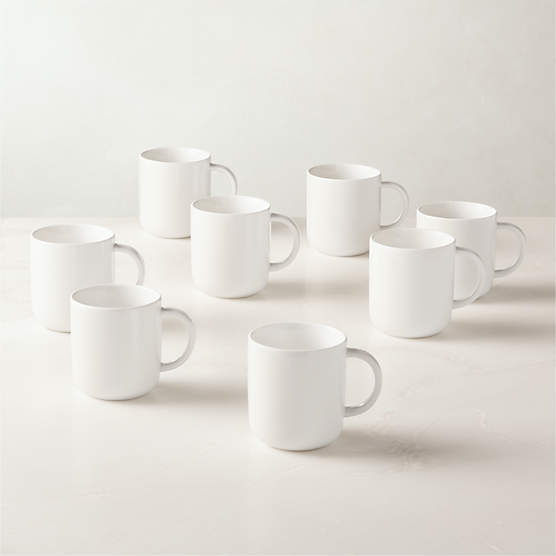
At what (x,y) coordinates should I click in order to perform the action: click on rim of the teacup. Please return your answer as a coordinate pair (x, y). This screenshot has height=556, width=556. Looking at the image, I should click on (109, 307), (74, 244), (155, 161), (215, 215), (332, 178), (441, 218), (411, 249), (296, 351).